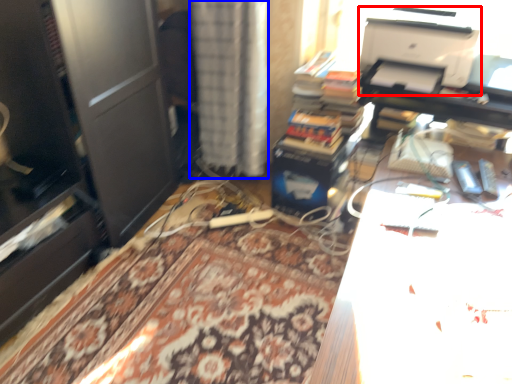
Question: Which of the following is the closest to the observer, printer (highlighted by a red box) or curtain (highlighted by a blue box)?

Choices:
 (A) printer
 (B) curtain

Answer: (A)